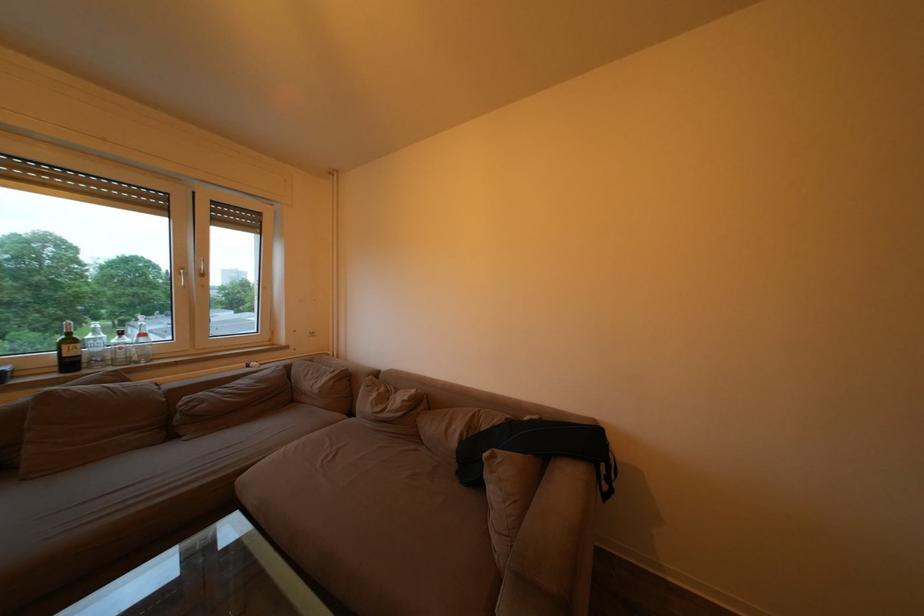
At what (x,y) coordinates should I click in order to perform the action: click on glass carafe. Please return your answer as a coordinate pair (x, y). Looking at the image, I should click on (120, 349).